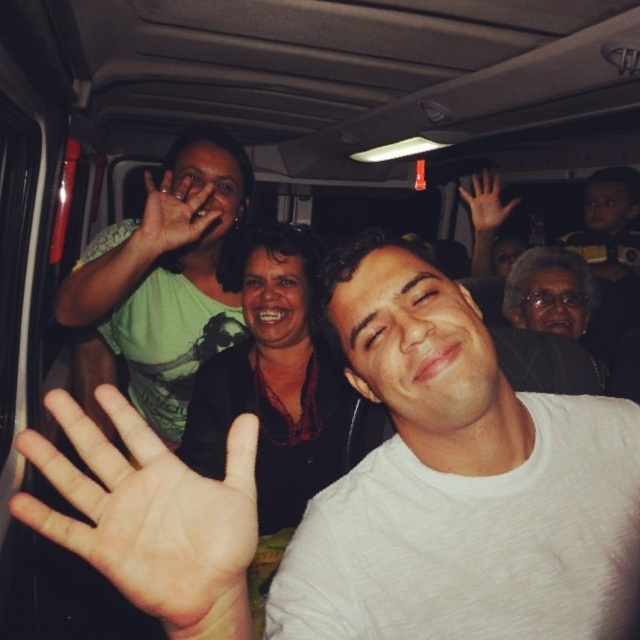
Between white cotton shirt at center and brown skin hand at upper right, which one is positioned lower?

Positioned lower is white cotton shirt at center.

Is white cotton shirt at center to the left of brown skin hand at upper right from the viewer's perspective?

Yes, white cotton shirt at center is to the left of brown skin hand at upper right.

Image resolution: width=640 pixels, height=640 pixels. Describe the element at coordinates (460, 483) in the screenshot. I see `white cotton shirt at center` at that location.

Identify the location of white cotton shirt at center. (460, 483).

Which of these two, brown skin hand at center or green matte shirt at upper left, stands taller?

green matte shirt at upper left is taller.

Between brown skin hand at center and green matte shirt at upper left, which one appears on the right side from the viewer's perspective?

brown skin hand at center is more to the right.

Which is in front, point (227, 508) or point (237, 170)?

Point (227, 508) is more forward.

I want to click on brown skin hand at center, so click(150, 516).

Between white cotton shirt at center and matte green hand at upper center, which one has more height?

Standing taller between the two is white cotton shirt at center.

Does white cotton shirt at center have a lesser width compared to matte green hand at upper center?

In fact, white cotton shirt at center might be wider than matte green hand at upper center.

Image resolution: width=640 pixels, height=640 pixels. Identify the location of white cotton shirt at center. (460, 483).

In order to click on white cotton shirt at center in this screenshot , I will do `click(460, 483)`.